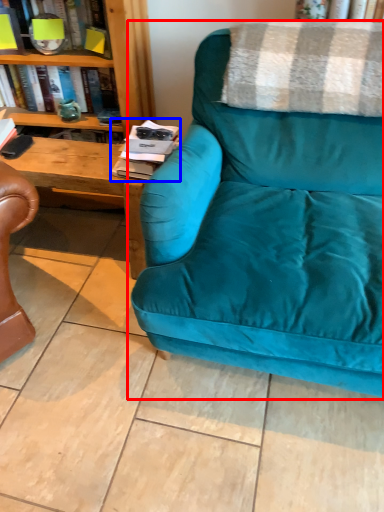
Question: Which of the following is the closest to the observer, studio couch (highlighted by a red box) or magazine (highlighted by a blue box)?

Choices:
 (A) studio couch
 (B) magazine

Answer: (A)